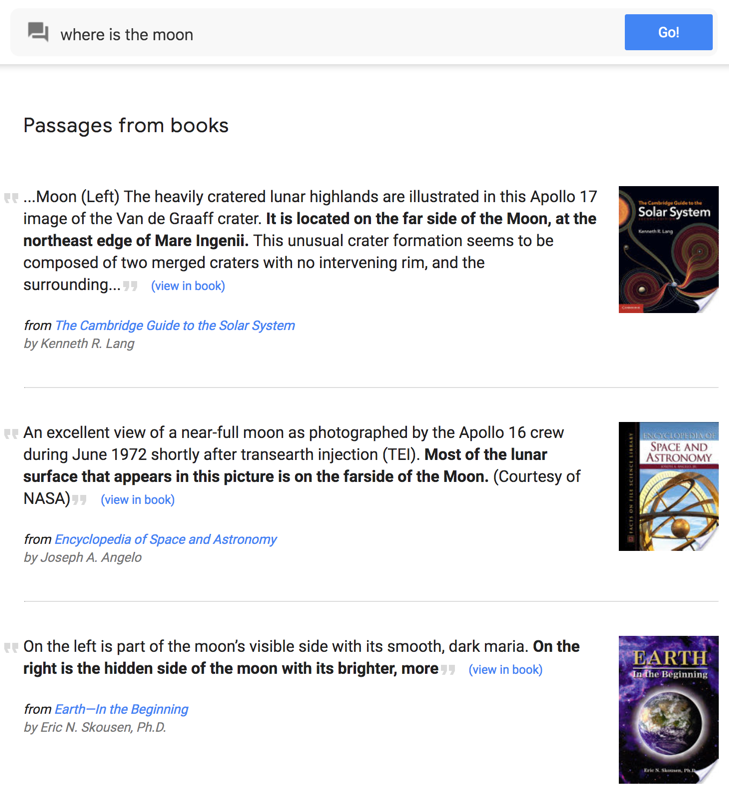
This screenshot has width=729, height=793. I want to click on black book cover, so click(663, 243).